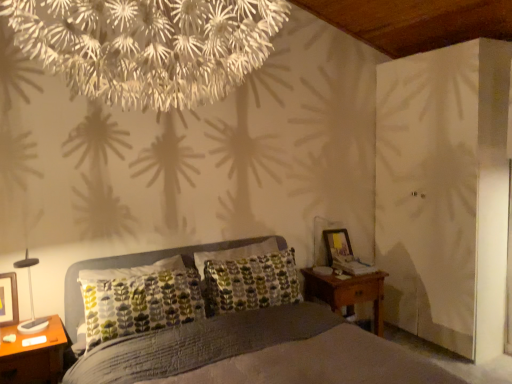
Question: Considering the relative sizes of textured gray bed at center and matte black picture frame at left, which is counted as the 1th picture frame, starting from the front, in the image provided, is textured gray bed at center shorter than matte black picture frame at left, which is counted as the 1th picture frame, starting from the front,?

Choices:
 (A) yes
 (B) no

Answer: (B)

Question: Considering the relative positions of textured gray bed at center and matte black picture frame at left, which appears as the 1th picture frame when viewed from the left, in the image provided, is textured gray bed at center to the right of matte black picture frame at left, which appears as the 1th picture frame when viewed from the left, from the viewer's perspective?

Choices:
 (A) no
 (B) yes

Answer: (B)

Question: From a real-world perspective, is textured gray bed at center below matte black picture frame at left, which appears as the 2th picture frame when viewed from the right?

Choices:
 (A) yes
 (B) no

Answer: (A)

Question: Considering the relative sizes of textured gray bed at center and matte black picture frame at left, which appears as the 1th picture frame when viewed from the left, in the image provided, is textured gray bed at center taller than matte black picture frame at left, which appears as the 1th picture frame when viewed from the left,?

Choices:
 (A) no
 (B) yes

Answer: (B)

Question: Can you confirm if textured gray bed at center is smaller than matte black picture frame at left, which appears as the 2th picture frame when viewed from the right?

Choices:
 (A) no
 (B) yes

Answer: (A)

Question: Is textured gray bed at center aimed at matte black picture frame at left, which appears as the 2th picture frame when viewed from the right?

Choices:
 (A) no
 (B) yes

Answer: (A)

Question: Is there a large distance between wooden nightstand at lower left, which is the 1th nightstand in left-to-right order, and textured gray bed at center?

Choices:
 (A) yes
 (B) no

Answer: (B)

Question: Is wooden nightstand at lower left, which is the 1th nightstand in left-to-right order, at the left side of textured gray bed at center?

Choices:
 (A) yes
 (B) no

Answer: (A)

Question: Is wooden nightstand at lower left, the second nightstand in the right-to-left sequence, further to the viewer compared to textured gray bed at center?

Choices:
 (A) no
 (B) yes

Answer: (B)

Question: From the image's perspective, is wooden nightstand at lower left, which is the 1th nightstand in left-to-right order, on textured gray bed at center?

Choices:
 (A) no
 (B) yes

Answer: (A)

Question: From the image's perspective, is wooden nightstand at lower left, positioned as the 2th nightstand in back-to-front order, beneath textured gray bed at center?

Choices:
 (A) no
 (B) yes

Answer: (B)

Question: Could you tell me if wooden nightstand at lower left, which is the 1th nightstand in left-to-right order, is facing textured gray bed at center?

Choices:
 (A) yes
 (B) no

Answer: (A)

Question: From a real-world perspective, is textured gray bed at center on top of wooden nightstand at lower left, positioned as the 2th nightstand in back-to-front order?

Choices:
 (A) no
 (B) yes

Answer: (B)